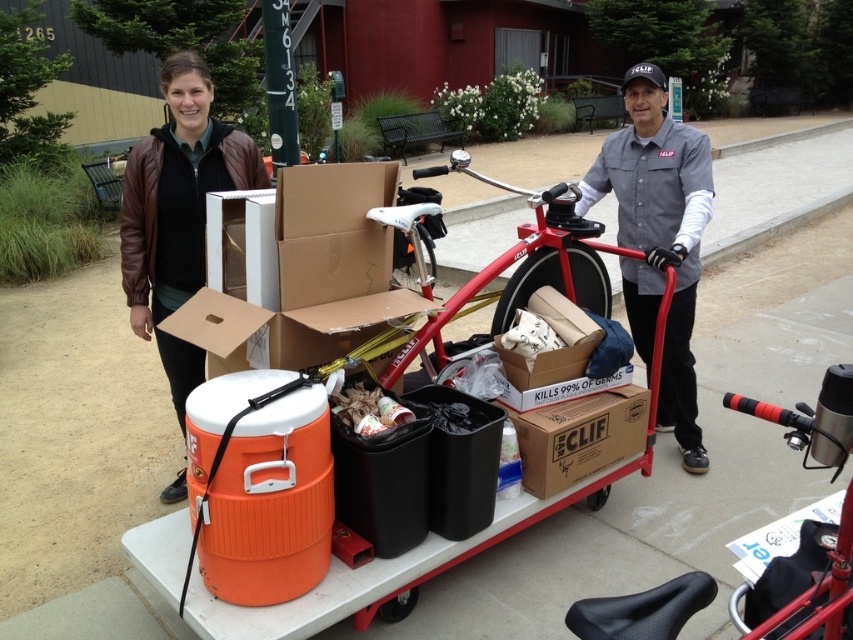
The height and width of the screenshot is (640, 853). What do you see at coordinates (177, 211) in the screenshot? I see `brown leather jacket at upper left` at bounding box center [177, 211].

Is brown leather jacket at upper left closer to camera compared to red matte bicycle at center?

That is False.

The width and height of the screenshot is (853, 640). What are the coordinates of `brown leather jacket at upper left` in the screenshot? It's located at (177, 211).

Does point (624, 136) lie in front of point (622, 632)?

No, it is not.

Does gray/denim shirt at center have a lesser height compared to red matte bicycle at center?

Incorrect, gray/denim shirt at center's height does not fall short of red matte bicycle at center's.

Is point (706, 154) closer to camera compared to point (688, 604)?

No, (706, 154) is behind (688, 604).

Locate an element on the screen. This screenshot has height=640, width=853. gray/denim shirt at center is located at coordinates (659, 237).

Between gray/denim shirt at center and brown leather jacket at upper left, which one has less height?

gray/denim shirt at center is shorter.

Between gray/denim shirt at center and brown leather jacket at upper left, which one is positioned higher?

gray/denim shirt at center

Which is behind, point (675, 433) or point (219, 170)?

The point (675, 433) is behind.

You are a GUI agent. You are given a task and a screenshot of the screen. Output one action in this format:
    pyautogui.click(x=<x>, y=<y>)
    Task: Click on the gray/denim shirt at center
    The height and width of the screenshot is (640, 853).
    Given the screenshot: What is the action you would take?
    pyautogui.click(x=659, y=237)